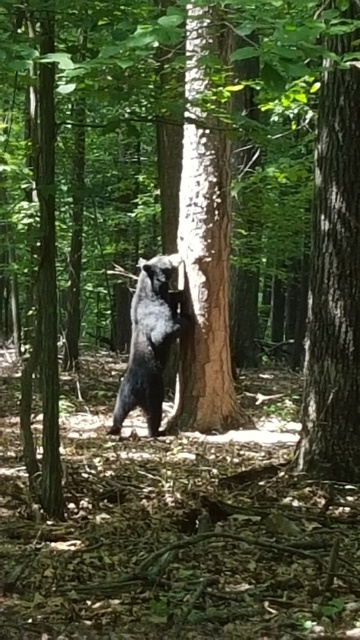
How distant is smooth brown tree trunk at right from brown rough tree trunk at center?

smooth brown tree trunk at right is 7.12 feet from brown rough tree trunk at center.

Can you confirm if smooth brown tree trunk at right is bigger than brown rough tree trunk at center?

Actually, smooth brown tree trunk at right might be smaller than brown rough tree trunk at center.

The height and width of the screenshot is (640, 360). I want to click on smooth brown tree trunk at right, so click(334, 285).

The image size is (360, 640). I want to click on smooth brown tree trunk at right, so click(334, 285).

Can you confirm if smooth brown tree trunk at right is positioned below shiny black bear at center?

Actually, smooth brown tree trunk at right is above shiny black bear at center.

Between point (344, 147) and point (137, 307), which one is positioned behind?

Positioned behind is point (137, 307).

Where is `smooth brown tree trunk at right`? This screenshot has width=360, height=640. smooth brown tree trunk at right is located at coordinates (334, 285).

Does brown rough tree trunk at center appear on the left side of shiny black bear at center?

In fact, brown rough tree trunk at center is to the right of shiny black bear at center.

Is brown rough tree trunk at center in front of shiny black bear at center?

Yes, it is.

Image resolution: width=360 pixels, height=640 pixels. In order to click on brown rough tree trunk at center in this screenshot , I will do `click(204, 244)`.